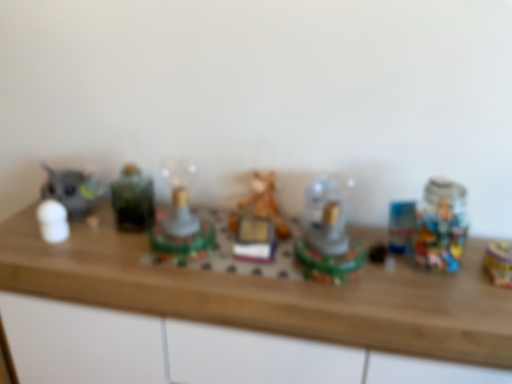
The height and width of the screenshot is (384, 512). Identify the location of vacant area situated to the left side of shiny green plastic toy at center, marked as the fourth toy in a right-to-left arrangement. (112, 258).